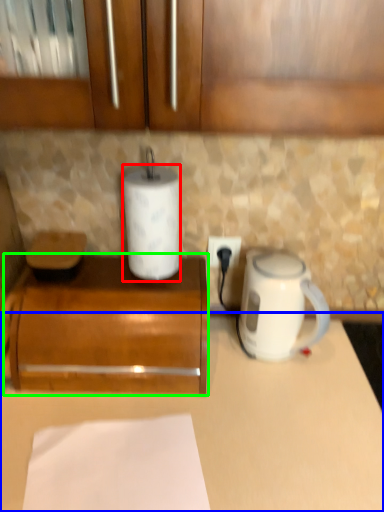
Question: Based on their relative distances, which object is nearer to paper towel (highlighted by a red box)? Choose from counter (highlighted by a blue box) and cabinetry (highlighted by a green box).

Choices:
 (A) counter
 (B) cabinetry

Answer: (B)